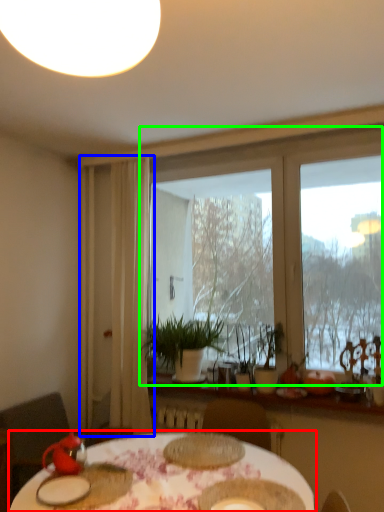
Question: Which object is positioned farthest from table (highlighted by a red box)? Select from curtain (highlighted by a blue box) and window (highlighted by a green box).

Choices:
 (A) curtain
 (B) window

Answer: (B)